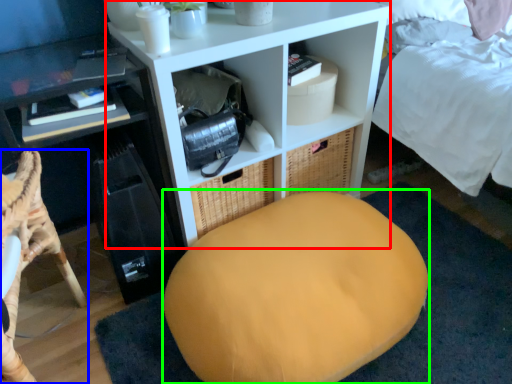
Question: Which object is the farthest from shelf (highlighted by a red box)? Choose among these: furniture (highlighted by a blue box) or bean bag chair (highlighted by a green box).

Choices:
 (A) furniture
 (B) bean bag chair

Answer: (A)